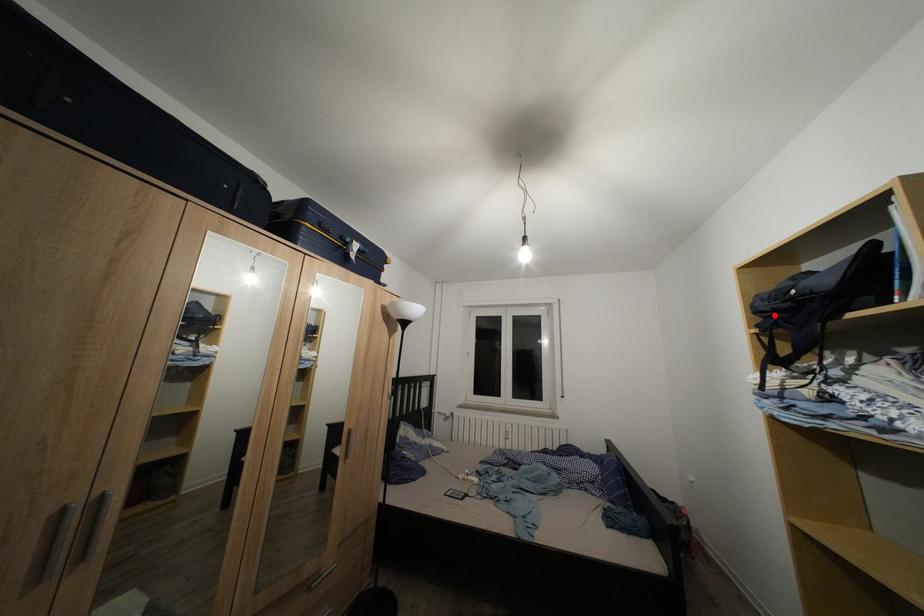
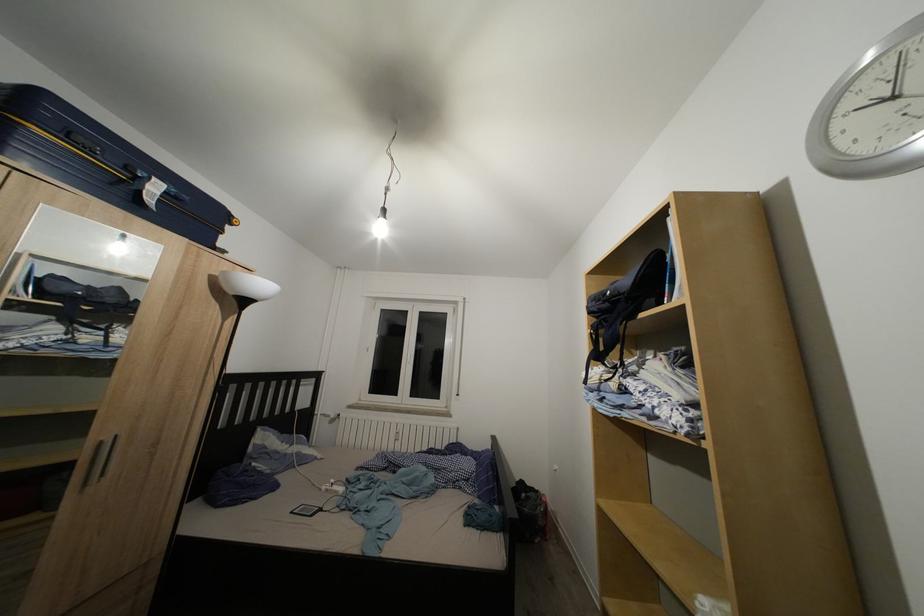
In the second image, find the point that corresponds to the highlighted location in the first image.

(602, 315)